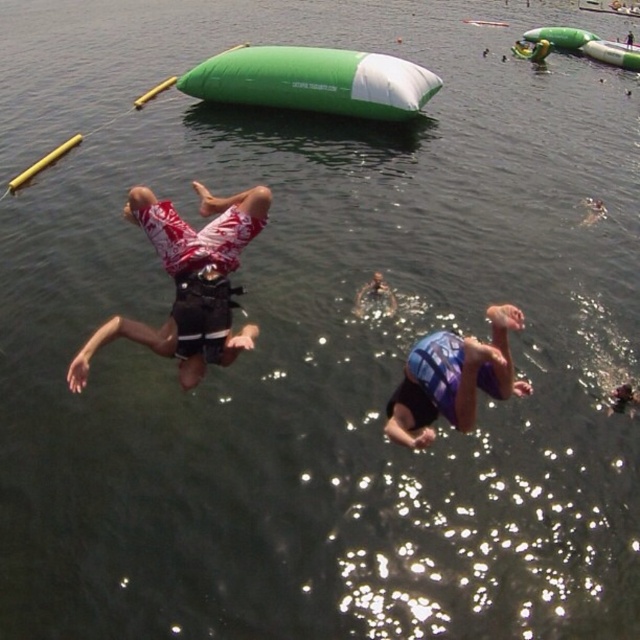
Can you confirm if printed cotton shorts at center is taller than blue mesh swimsuit at center?

No, printed cotton shorts at center is not taller than blue mesh swimsuit at center.

Can you confirm if printed cotton shorts at center is positioned above blue mesh swimsuit at center?

Correct, printed cotton shorts at center is located above blue mesh swimsuit at center.

Which is behind, point (189, 275) or point (461, 390)?

The point (189, 275) is more distant.

Image resolution: width=640 pixels, height=640 pixels. I want to click on printed cotton shorts at center, so click(189, 282).

Which is more to the right, blue mesh swimsuit at center or blue textured life vest at center?

From the viewer's perspective, blue mesh swimsuit at center appears more on the right side.

Can you confirm if blue mesh swimsuit at center is positioned to the left of blue textured life vest at center?

Incorrect, blue mesh swimsuit at center is not on the left side of blue textured life vest at center.

Is point (420, 344) positioned after point (378, 291)?

No, (420, 344) is in front of (378, 291).

Identify the location of blue mesh swimsuit at center. (452, 380).

Can you confirm if printed cotton shorts at center is positioned to the right of blue textured life vest at center?

In fact, printed cotton shorts at center is to the left of blue textured life vest at center.

Locate an element on the screen. printed cotton shorts at center is located at coordinates pos(189,282).